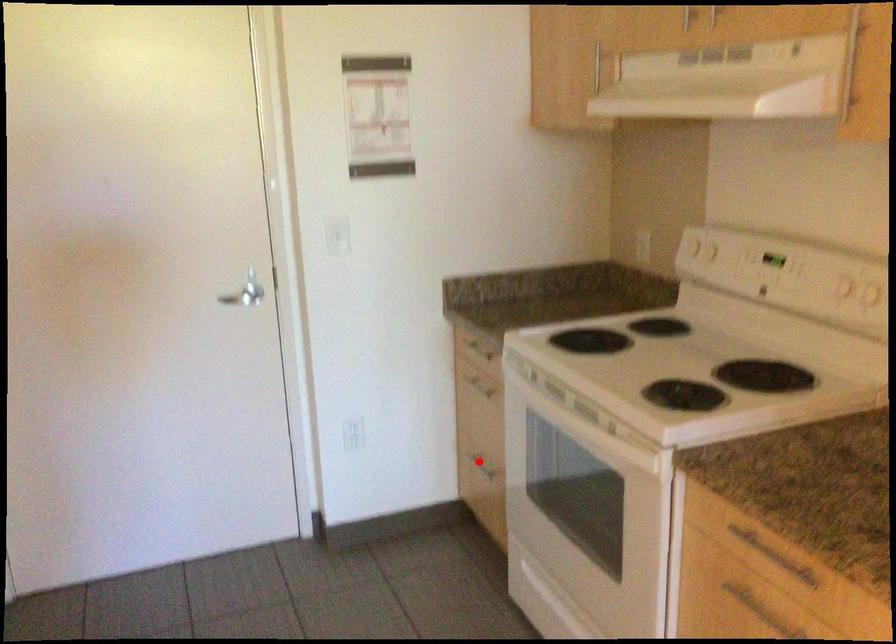
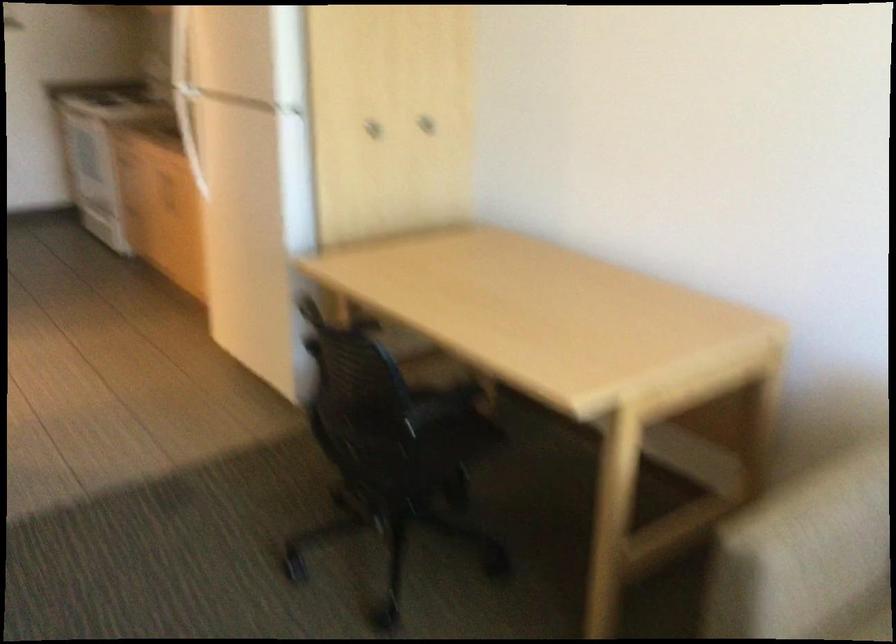
Question: I am providing you with two images of the same scene from different viewpoints. A red point is marked on the first image. At the location where the point appears in image 1, is it still visible in image 2?

Choices:
 (A) Yes
 (B) No

Answer: (B)